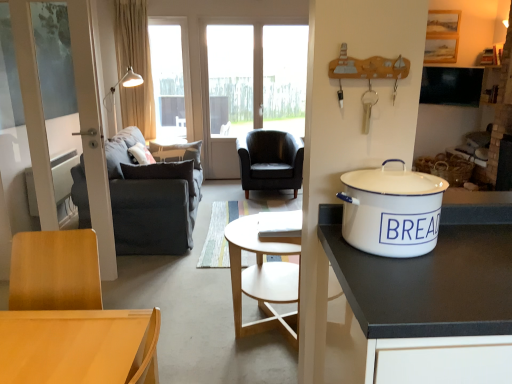
The height and width of the screenshot is (384, 512). Describe the element at coordinates (170, 77) in the screenshot. I see `transparent glass window at upper center` at that location.

You are a GUI agent. You are given a task and a screenshot of the screen. Output one action in this format:
    pyautogui.click(x=<x>, y=<y>)
    Task: Click on the black leather chair at center
    
    Given the screenshot: What is the action you would take?
    pyautogui.click(x=270, y=161)

What is the approximate height of light brown wood desk at lower left?

light brown wood desk at lower left is 13.32 inches tall.

The image size is (512, 384). What do you see at coordinates (391, 211) in the screenshot?
I see `white enamel bread bin at right` at bounding box center [391, 211].

Identify the location of transparent glass window at upper center. (170, 77).

From the image's perspective, is black leather chair at center below white enamel bread bin at right?

No.

Considering the positions of objects black leather chair at center and white enamel bread bin at right in the image provided, who is more to the left, black leather chair at center or white enamel bread bin at right?

From the viewer's perspective, black leather chair at center appears more on the left side.

Does black leather chair at center lie behind white enamel bread bin at right?

Yes, it is.

Is point (266, 185) closer or farther from the camera than point (438, 221)?

Clearly, point (266, 185) is more distant from the camera than point (438, 221).

Is transparent glass window at upper center with dark gray fabric couch at left?

No, transparent glass window at upper center is not making contact with dark gray fabric couch at left.

From a real-world perspective, does transparent glass window at upper center stand above dark gray fabric couch at left?

Yes, from a real-world perspective, transparent glass window at upper center is on top of dark gray fabric couch at left.

I want to click on window behind the dark gray fabric couch at left, so click(x=170, y=77).

Considering the relative sizes of light brown wood desk at lower left and beige fabric curtain at upper left in the image provided, is light brown wood desk at lower left taller than beige fabric curtain at upper left?

No, light brown wood desk at lower left is not taller than beige fabric curtain at upper left.

Image resolution: width=512 pixels, height=384 pixels. I want to click on curtain above the light brown wood desk at lower left (from the image's perspective), so click(135, 65).

From a real-world perspective, between light brown wood desk at lower left and beige fabric curtain at upper left, who is vertically lower?

light brown wood desk at lower left, from a real-world perspective.

Is light brown wood desk at lower left at the right side of beige fabric curtain at upper left?

Yes.

Measure the distance between light brown wood desk at lower left and white enamel bread bin at right.

light brown wood desk at lower left and white enamel bread bin at right are 30.22 inches apart from each other.

Is light brown wood desk at lower left oriented towards white enamel bread bin at right?

No.

Is white enamel bread bin at right completely or partially inside light brown wood desk at lower left?

No, light brown wood desk at lower left does not contain white enamel bread bin at right.

The width and height of the screenshot is (512, 384). What are the coordinates of `tableware located above the light brown wood desk at lower left (from a real-world perspective)` in the screenshot? It's located at (391, 211).

Which is in front, white enamel bread bin at right or dark gray fabric couch at left?

white enamel bread bin at right is in front.

Is white enamel bread bin at right thinner than dark gray fabric couch at left?

Indeed, white enamel bread bin at right has a lesser width compared to dark gray fabric couch at left.

Which point is more forward, (x=352, y=218) or (x=127, y=208)?

The point (x=352, y=218) is more forward.

Who is bigger, white enamel bread bin at right or dark gray fabric couch at left?

dark gray fabric couch at left.

From the image's perspective, is dark gray fabric couch at left located beneath transparent glass window at upper center?

Yes, from the image's perspective, dark gray fabric couch at left is below transparent glass window at upper center.

Considering their positions, is dark gray fabric couch at left located in front of or behind transparent glass window at upper center?

dark gray fabric couch at left is in front of transparent glass window at upper center.

Based on the photo, does dark gray fabric couch at left appear on the left side of transparent glass window at upper center?

Incorrect, dark gray fabric couch at left is not on the left side of transparent glass window at upper center.

Is transparent glass window at upper center completely or partially inside dark gray fabric couch at left?

No.

Which is in front, point (143, 58) or point (424, 176)?

The point (424, 176) is more forward.

How many degrees apart are the facing directions of beige fabric curtain at upper left and white enamel bread bin at right?

The facing directions of beige fabric curtain at upper left and white enamel bread bin at right are 0.0188 degrees apart.

From the image's perspective, which one is positioned higher, beige fabric curtain at upper left or white enamel bread bin at right?

beige fabric curtain at upper left, from the image's perspective.

Based on the photo, is beige fabric curtain at upper left outside of white enamel bread bin at right?

That's correct, beige fabric curtain at upper left is outside of white enamel bread bin at right.

The height and width of the screenshot is (384, 512). In the image, there is a white enamel bread bin at right. In order to click on chair below it (from a real-world perspective) in this screenshot , I will do `click(270, 161)`.

Find the location of a particular element. studio couch located in front of the transparent glass window at upper center is located at coordinates (152, 199).

Looking at the image, which one is located further to light brown wood desk at lower left, beige fabric curtain at upper left or dark gray fabric couch at left?

beige fabric curtain at upper left is further to light brown wood desk at lower left.

From the image, which object appears to be farther from transparent glass window at upper center, black leather chair at center or beige fabric curtain at upper left?

black leather chair at center.

When comparing their distances from transparent glass window at upper center, does light brown wood desk at lower left or dark gray fabric couch at left seem closer?

dark gray fabric couch at left is closer to transparent glass window at upper center.

When comparing their distances from transparent glass window at upper center, does beige fabric curtain at upper left or black leather chair at center seem further?

black leather chair at center is further to transparent glass window at upper center.

Looking at the image, which one is located further to black leather chair at center, dark gray fabric couch at left or beige fabric curtain at upper left?

Among the two, beige fabric curtain at upper left is located further to black leather chair at center.

Which object lies further to the anchor point beige fabric curtain at upper left, white enamel bread bin at right or dark gray fabric couch at left?

The object further to beige fabric curtain at upper left is white enamel bread bin at right.

From the image, which object appears to be nearer to beige fabric curtain at upper left, transparent glass window at upper center or white enamel bread bin at right?

Based on the image, transparent glass window at upper center appears to be nearer to beige fabric curtain at upper left.

Considering their positions, is beige fabric curtain at upper left positioned further to transparent glass window at upper center than light brown wood desk at lower left?

Among the two, light brown wood desk at lower left is located further to transparent glass window at upper center.

Where is `chair between dark gray fabric couch at left and transparent glass window at upper center along the z-axis`? chair between dark gray fabric couch at left and transparent glass window at upper center along the z-axis is located at coordinates (270, 161).

Identify the location of studio couch between white enamel bread bin at right and beige fabric curtain at upper left along the z-axis. (152, 199).

Where is `studio couch between white enamel bread bin at right and transparent glass window at upper center from front to back`? studio couch between white enamel bread bin at right and transparent glass window at upper center from front to back is located at coordinates (152, 199).

At what (x,y) coordinates should I click in order to perform the action: click on studio couch between light brown wood desk at lower left and beige fabric curtain at upper left in the front-back direction. Please return your answer as a coordinate pair (x, y). Image resolution: width=512 pixels, height=384 pixels. Looking at the image, I should click on (152, 199).